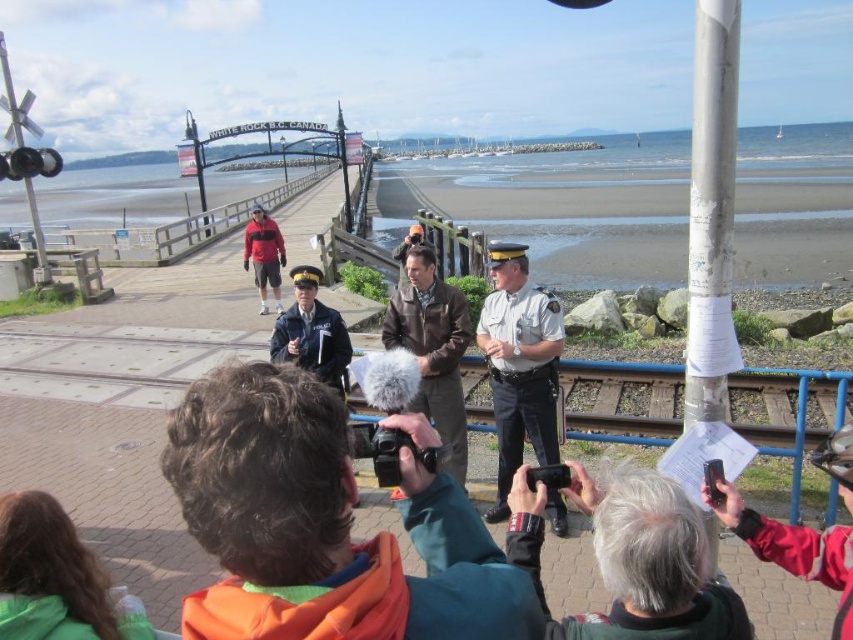
Question: Is red matte jacket at lower right to the right of matte black jacket at center from the viewer's perspective?

Choices:
 (A) no
 (B) yes

Answer: (B)

Question: Does orange fleece jacket at center appear over matte black jacket at center?

Choices:
 (A) yes
 (B) no

Answer: (B)

Question: Which object is farther from the camera taking this photo?

Choices:
 (A) brown leather jacket at center
 (B) red matte jacket at lower right
 (C) matte black jacket at center

Answer: (C)

Question: Which of the following is the farthest from the observer?

Choices:
 (A) uniformed officer at center
 (B) light gray uniform at center
 (C) brown leather jacket at center
 (D) red matte jacket at lower right

Answer: (A)

Question: Where is light gray uniform at center located in relation to red matte jacket at lower right in the image?

Choices:
 (A) below
 (B) above

Answer: (B)

Question: Which object is farther from the camera taking this photo?

Choices:
 (A) matte black jacket at center
 (B) light gray uniform at center
 (C) uniformed officer at center

Answer: (A)